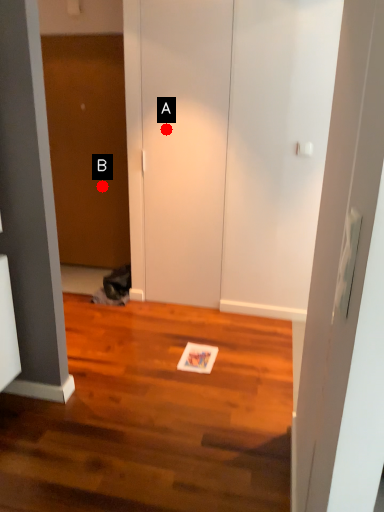
Question: Two points are circled on the image, labeled by A and B beside each circle. Among these points, which one is farthest from the camera?

Choices:
 (A) A is further
 (B) B is further

Answer: (B)